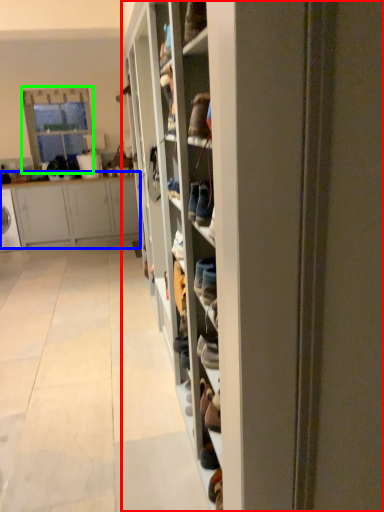
Question: Based on their relative distances, which object is nearer to shelf (highlighted by a red box)? Choose from cabinetry (highlighted by a blue box) and glass door (highlighted by a green box).

Choices:
 (A) cabinetry
 (B) glass door

Answer: (A)